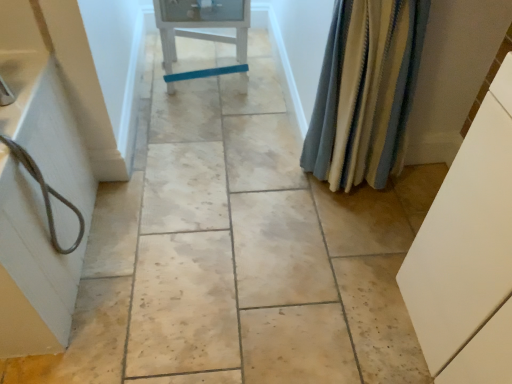
What do you see at coordinates (365, 92) in the screenshot? This screenshot has width=512, height=384. I see `striped fabric shower curtain at right` at bounding box center [365, 92].

The image size is (512, 384). What are the coordinates of `white painted wood chair at center` in the screenshot? It's located at (202, 24).

Is white painted wood chair at center to the left of striped fabric shower curtain at right from the viewer's perspective?

Yes.

Considering the sizes of objects white painted wood chair at center and striped fabric shower curtain at right in the image provided, who is thinner, white painted wood chair at center or striped fabric shower curtain at right?

striped fabric shower curtain at right.

Which is in front, point (164, 23) or point (361, 159)?

Positioned in front is point (361, 159).

Image resolution: width=512 pixels, height=384 pixels. What are the coordinates of `furniture located underneath the striped fabric shower curtain at right (from a real-world perspective)` in the screenshot? It's located at (202, 24).

Where is `bath positioned vertically above the striped fabric shower curtain at right (from a real-world perspective)`? This screenshot has width=512, height=384. bath positioned vertically above the striped fabric shower curtain at right (from a real-world perspective) is located at coordinates (31, 270).

Relative to striped fabric shower curtain at right, is matte gray cord at left in front or behind?

In the image, matte gray cord at left appears in front of striped fabric shower curtain at right.

Can you confirm if matte gray cord at left is bigger than striped fabric shower curtain at right?

Correct, matte gray cord at left is larger in size than striped fabric shower curtain at right.

From a real-world perspective, relative to striped fabric shower curtain at right, is matte gray cord at left vertically above or below?

In terms of real-world spatial position, matte gray cord at left is above striped fabric shower curtain at right.

What's the angular difference between white matte cabinet at right and striped fabric shower curtain at right's facing directions?

The angular difference between white matte cabinet at right and striped fabric shower curtain at right is 88 degrees.

Visually, is white matte cabinet at right positioned to the left or to the right of striped fabric shower curtain at right?

white matte cabinet at right is positioned on striped fabric shower curtain at right's right side.

Is striped fabric shower curtain at right completely or partially inside white matte cabinet at right?

Definitely not — striped fabric shower curtain at right is not inside white matte cabinet at right.

Which is closer, (448, 293) or (378, 156)?

Point (448, 293) is closer to the camera than point (378, 156).

Is white matte cabinet at right at the back of striped fabric shower curtain at right?

No, striped fabric shower curtain at right is not facing away from white matte cabinet at right.

Do you think striped fabric shower curtain at right is within white matte cabinet at right, or outside of it?

striped fabric shower curtain at right lies outside white matte cabinet at right.

Are striped fabric shower curtain at right and white matte cabinet at right far apart?

No, striped fabric shower curtain at right is in close proximity to white matte cabinet at right.

The image size is (512, 384). Find the location of `shower curtain that appears above the white matte cabinet at right (from the image's perspective)`. shower curtain that appears above the white matte cabinet at right (from the image's perspective) is located at coordinates (365, 92).

Is matte gray cord at left aimed at white painted wood chair at center?

No, matte gray cord at left is not aimed at white painted wood chair at center.

Can you confirm if matte gray cord at left is shorter than white painted wood chair at center?

Incorrect, the height of matte gray cord at left does not fall short of that of white painted wood chair at center.

Considering the relative sizes of matte gray cord at left and white painted wood chair at center in the image provided, is matte gray cord at left thinner than white painted wood chair at center?

Correct, the width of matte gray cord at left is less than that of white painted wood chair at center.

Is point (40, 38) behind point (167, 40)?

That is False.

Is white matte cabinet at right oriented towards white painted wood chair at center?

No, white matte cabinet at right is not aimed at white painted wood chair at center.

Which of these two, white matte cabinet at right or white painted wood chair at center, is thinner?

white painted wood chair at center.

Considering the sizes of objects white matte cabinet at right and white painted wood chair at center in the image provided, who is smaller, white matte cabinet at right or white painted wood chair at center?

Smaller between the two is white painted wood chair at center.

Which is behind, white matte cabinet at right or white painted wood chair at center?

white painted wood chair at center.

Which object is positioned more to the right, white painted wood chair at center or matte gray cord at left?

white painted wood chair at center.

Is point (196, 20) closer to camera compared to point (6, 333)?

No, (196, 20) is further to viewer.

Is white painted wood chair at center bigger than matte gray cord at left?

Yes, white painted wood chair at center is bigger than matte gray cord at left.

What's the angular difference between white painted wood chair at center and matte gray cord at left's facing directions?

The facing directions of white painted wood chair at center and matte gray cord at left are 85 degrees apart.

Find the location of `shower curtain above the white painted wood chair at center (from a real-world perspective)`. shower curtain above the white painted wood chair at center (from a real-world perspective) is located at coordinates (365, 92).

The width and height of the screenshot is (512, 384). What are the coordinates of `bath to the left of striped fabric shower curtain at right` in the screenshot? It's located at (31, 270).

Estimate the real-world distances between objects in this image. Which object is closer to striped fabric shower curtain at right, matte gray cord at left or white matte cabinet at right?

Based on the image, white matte cabinet at right appears to be nearer to striped fabric shower curtain at right.

Considering their positions, is white painted wood chair at center positioned closer to matte gray cord at left than striped fabric shower curtain at right?

Among the two, striped fabric shower curtain at right is located nearer to matte gray cord at left.

Considering their positions, is white matte cabinet at right positioned closer to matte gray cord at left than striped fabric shower curtain at right?

The object closer to matte gray cord at left is striped fabric shower curtain at right.

Which object lies further to the anchor point white painted wood chair at center, matte gray cord at left or striped fabric shower curtain at right?

matte gray cord at left.

Estimate the real-world distances between objects in this image. Which object is closer to matte gray cord at left, striped fabric shower curtain at right or white painted wood chair at center?

Among the two, striped fabric shower curtain at right is located nearer to matte gray cord at left.

Estimate the real-world distances between objects in this image. Which object is further from striped fabric shower curtain at right, white painted wood chair at center or matte gray cord at left?

Among the two, white painted wood chair at center is located further to striped fabric shower curtain at right.

From the image, which object appears to be nearer to white painted wood chair at center, matte gray cord at left or white matte cabinet at right?

matte gray cord at left.

Based on the photo, estimate the real-world distances between objects in this image. Which object is closer to white painted wood chair at center, striped fabric shower curtain at right or white matte cabinet at right?

striped fabric shower curtain at right lies closer to white painted wood chair at center than the other object.

You are a GUI agent. You are given a task and a screenshot of the screen. Output one action in this format:
    pyautogui.click(x=<x>, y=<y>)
    Task: Click on the furniture between matte gray cord at left and white matte cabinet at right
    This screenshot has width=512, height=384.
    Given the screenshot: What is the action you would take?
    pyautogui.click(x=202, y=24)

Locate an element on the screen. The image size is (512, 384). shower curtain between white matte cabinet at right and white painted wood chair at center in the front-back direction is located at coordinates (365, 92).

This screenshot has width=512, height=384. I want to click on shower curtain situated between matte gray cord at left and white matte cabinet at right from left to right, so click(365, 92).

Find the location of a particular element. furniture situated between matte gray cord at left and striped fabric shower curtain at right from left to right is located at coordinates (202, 24).